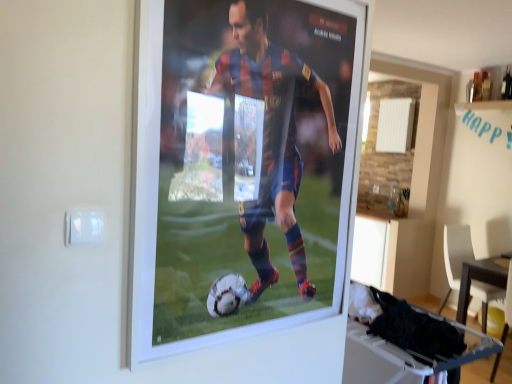
You are a GUI agent. You are given a task and a screenshot of the screen. Output one action in this format:
    pyautogui.click(x=<x>, y=<y>)
    Task: Click on the white plastic chair at lower right
    The image size is (512, 384).
    Given the screenshot: What is the action you would take?
    pyautogui.click(x=456, y=256)

The width and height of the screenshot is (512, 384). Find the location of `white plastic table at lower right, the 2th table when ordered from bottom to top`. white plastic table at lower right, the 2th table when ordered from bottom to top is located at coordinates (400, 347).

Locate an element on the screen. This screenshot has height=384, width=512. wooden table at lower right, the second table from the left is located at coordinates (480, 279).

Is wooden table at lower right, arranged as the first table when viewed from the back, at the right side of white plastic chair at lower right?

Indeed, wooden table at lower right, arranged as the first table when viewed from the back, is positioned on the right side of white plastic chair at lower right.

From the image's perspective, is wooden table at lower right, arranged as the 1th table when viewed from the right, under white plastic chair at lower right?

Indeed, from the image's perspective, wooden table at lower right, arranged as the 1th table when viewed from the right, is shown beneath white plastic chair at lower right.

Which is less distant, (459, 320) or (455, 265)?

Point (459, 320)

Could you tell me if white plastic chair at lower right is facing white plastic table at lower right, placed as the 1th table when sorted from top to bottom?

No, white plastic chair at lower right is not oriented towards white plastic table at lower right, placed as the 1th table when sorted from top to bottom.

Considering the sizes of objects white plastic chair at lower right and white plastic table at lower right, which is counted as the 1th table, starting from the left, in the image provided, who is thinner, white plastic chair at lower right or white plastic table at lower right, which is counted as the 1th table, starting from the left,?

Thinner between the two is white plastic table at lower right, which is counted as the 1th table, starting from the left.

Does white plastic chair at lower right have a larger size compared to white plastic table at lower right, the 2th table when ordered from bottom to top?

Yes.

From the image's perspective, who appears lower, white plastic chair at lower right or white plastic table at lower right, which ranks as the 1th table in front-to-back order?

white plastic chair at lower right.

Who is taller, wooden table at lower right, the second table positioned from the front, or white plastic table at lower right, placed as the 2th table when sorted from back to front?

wooden table at lower right, the second table positioned from the front.

From the image's perspective, does wooden table at lower right, the second table positioned from the front, appear higher than white plastic table at lower right, which is counted as the 1th table, starting from the left?

Incorrect, from the image's perspective, wooden table at lower right, the second table positioned from the front, is lower than white plastic table at lower right, which is counted as the 1th table, starting from the left.

Considering the relative positions of wooden table at lower right, arranged as the first table when viewed from the back, and white plastic table at lower right, placed as the 2th table when sorted from back to front, in the image provided, is wooden table at lower right, arranged as the first table when viewed from the back, in front of white plastic table at lower right, placed as the 2th table when sorted from back to front,?

No, wooden table at lower right, arranged as the first table when viewed from the back, is further to the viewer.

Is white plastic table at lower right, placed as the 1th table when sorted from top to bottom, inside wooden table at lower right, the second table positioned from the front?

No.

Measure the distance between white plastic chair at lower right and wooden table at lower right, arranged as the 1th table when viewed from the right.

white plastic chair at lower right is 5.87 inches from wooden table at lower right, arranged as the 1th table when viewed from the right.

Which of these two, white plastic chair at lower right or wooden table at lower right, the second table positioned from the front, is wider?

With larger width is wooden table at lower right, the second table positioned from the front.

Can you confirm if white plastic chair at lower right is positioned to the right of wooden table at lower right, arranged as the 1th table when viewed from the right?

No.

From a real-world perspective, is white plastic chair at lower right positioned above or below wooden table at lower right, which is counted as the 2th table, starting from the top?

white plastic chair at lower right is above wooden table at lower right, which is counted as the 2th table, starting from the top.

Could you tell me if white plastic table at lower right, which is counted as the 1th table, starting from the left, is facing wooden table at lower right, arranged as the first table when ordered from the bottom?

No.

Is white plastic table at lower right, which is counted as the 1th table, starting from the left, thinner than wooden table at lower right, the second table from the left?

Correct, the width of white plastic table at lower right, which is counted as the 1th table, starting from the left, is less than that of wooden table at lower right, the second table from the left.

Consider the image. Is the surface of white plastic table at lower right, which is counted as the 1th table, starting from the left, in direct contact with wooden table at lower right, the second table positioned from the front?

No, white plastic table at lower right, which is counted as the 1th table, starting from the left, is not with wooden table at lower right, the second table positioned from the front.

Considering the positions of point (357, 375) and point (458, 299), is point (357, 375) closer or farther from the camera than point (458, 299)?

Point (357, 375).

Locate an element on the screen. The image size is (512, 384). table that is on the left side of white plastic chair at lower right is located at coordinates (400, 347).

Would you say white plastic table at lower right, which ranks as the 1th table in front-to-back order, is to the left or to the right of white plastic chair at lower right in the picture?

From the image, it's evident that white plastic table at lower right, which ranks as the 1th table in front-to-back order, is to the left of white plastic chair at lower right.

Between point (426, 367) and point (487, 288), which one is positioned in front?

The point (426, 367) is in front.

You are a GUI agent. You are given a task and a screenshot of the screen. Output one action in this format:
    pyautogui.click(x=<x>, y=<y>)
    Task: Click on the chair above the wooden table at lower right, which is counted as the 2th table, starting from the top (from the image's perspective)
    
    Given the screenshot: What is the action you would take?
    [456, 256]

Where is `table on the left side of white plastic chair at lower right`? table on the left side of white plastic chair at lower right is located at coordinates (400, 347).

Based on their spatial positions, is white plastic chair at lower right or wooden table at lower right, arranged as the 1th table when viewed from the right, closer to white plastic table at lower right, which ranks as the 1th table in front-to-back order?

Based on the image, wooden table at lower right, arranged as the 1th table when viewed from the right, appears to be nearer to white plastic table at lower right, which ranks as the 1th table in front-to-back order.

Looking at the image, which one is located closer to wooden table at lower right, arranged as the 1th table when viewed from the right, white plastic table at lower right, placed as the 2th table when sorted from back to front, or white plastic chair at lower right?

white plastic chair at lower right is closer to wooden table at lower right, arranged as the 1th table when viewed from the right.

Consider the image. Estimate the real-world distances between objects in this image. Which object is closer to white plastic chair at lower right, white plastic table at lower right, which ranks as the 1th table in front-to-back order, or wooden table at lower right, which is counted as the 2th table, starting from the top?

The object closer to white plastic chair at lower right is wooden table at lower right, which is counted as the 2th table, starting from the top.

Looking at the image, which one is located further to white plastic chair at lower right, wooden table at lower right, the second table from the left, or white plastic table at lower right, which is counted as the 1th table, starting from the left?

white plastic table at lower right, which is counted as the 1th table, starting from the left.

Considering their positions, is white plastic chair at lower right positioned closer to wooden table at lower right, which is counted as the 2th table, starting from the top, than white plastic table at lower right, placed as the second table when sorted from right to left?

Among the two, white plastic chair at lower right is located nearer to wooden table at lower right, which is counted as the 2th table, starting from the top.

Estimate the real-world distances between objects in this image. Which object is further from white plastic table at lower right, placed as the 1th table when sorted from top to bottom, wooden table at lower right, the second table positioned from the front, or white plastic chair at lower right?

The object further to white plastic table at lower right, placed as the 1th table when sorted from top to bottom, is white plastic chair at lower right.

You are a GUI agent. You are given a task and a screenshot of the screen. Output one action in this format:
    pyautogui.click(x=<x>, y=<y>)
    Task: Click on the table between white plastic table at lower right, placed as the 1th table when sorted from top to bottom, and white plastic chair at lower right, along the z-axis
    
    Given the screenshot: What is the action you would take?
    [480, 279]